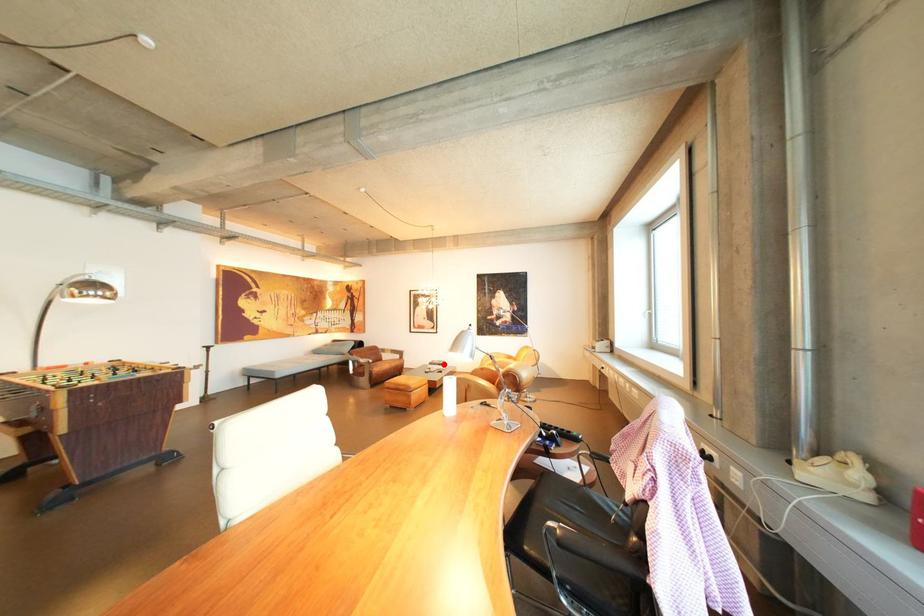
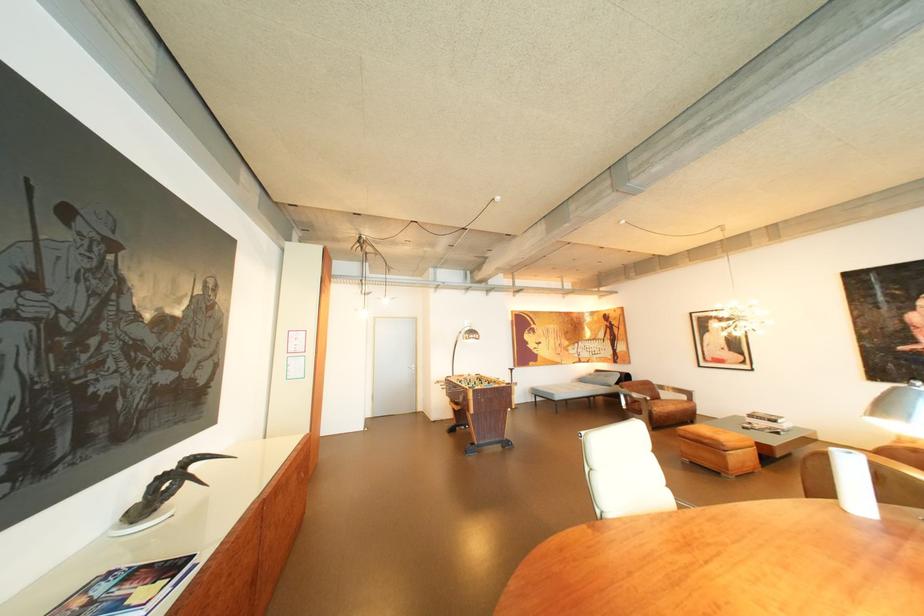
In the second image, find the point that corresponds to the highlighted location in the first image.

(763, 416)